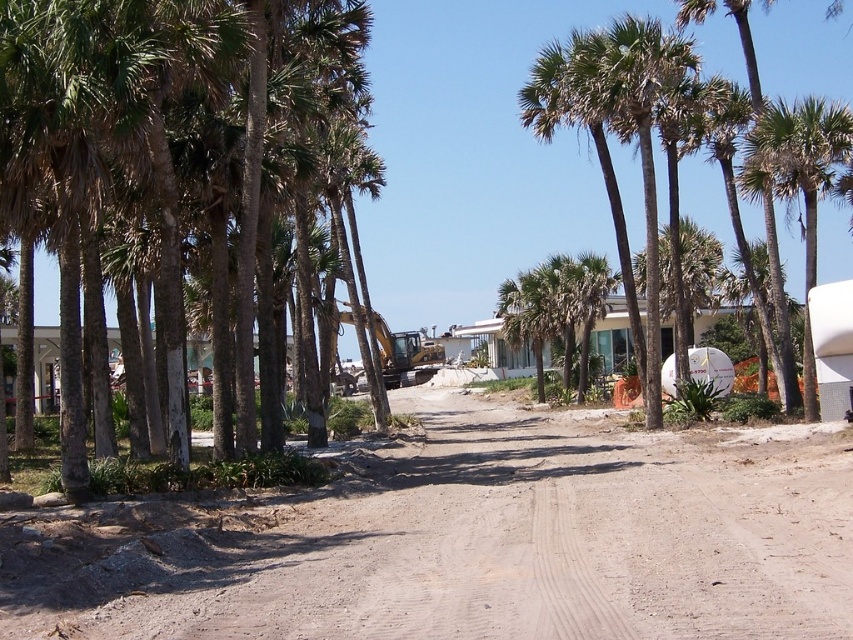
Question: Can you confirm if brown sandy dirt at center is wider than green leafy palm tree at center?

Choices:
 (A) yes
 (B) no

Answer: (A)

Question: Which of the following is the closest to the observer?

Choices:
 (A) green leafy palm trees at left
 (B) green leafy palm tree at right
 (C) brown sandy dirt at center

Answer: (C)

Question: Which point is closer to the camera?

Choices:
 (A) green leafy palm trees at left
 (B) green leafy palm tree at right
 (C) green leafy palm tree at center
 (D) brown sandy dirt at center

Answer: (D)

Question: Does green leafy palm tree at right appear over green leafy palm tree at center?

Choices:
 (A) no
 (B) yes

Answer: (A)

Question: Which object is the closest to the green leafy palm tree at center?

Choices:
 (A) green leafy palm tree at right
 (B) brown sandy dirt at center
 (C) green leafy palm trees at left

Answer: (A)

Question: Does green leafy palm tree at right have a lesser width compared to green leafy palm tree at center?

Choices:
 (A) no
 (B) yes

Answer: (A)